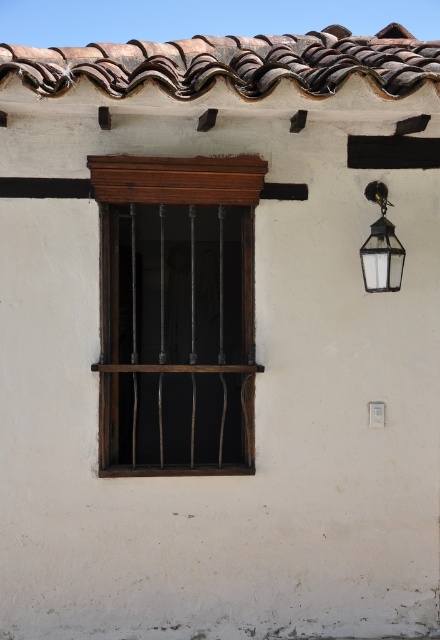
Question: Does brown textured tiles at upper center have a smaller size compared to matte glass lantern at upper right?

Choices:
 (A) yes
 (B) no

Answer: (A)

Question: Considering the real-world distances, which object is closest to the dark wood window frame at center?

Choices:
 (A) matte glass lantern at upper right
 (B) brown textured tiles at upper center

Answer: (A)

Question: Which point is farther to the camera?

Choices:
 (A) (230, 449)
 (B) (381, 220)

Answer: (A)

Question: Which of the following is the farthest from the observer?

Choices:
 (A) brown textured tiles at upper center
 (B) dark wood window frame at center

Answer: (B)

Question: Is dark wood window frame at center thinner than matte glass lantern at upper right?

Choices:
 (A) yes
 (B) no

Answer: (B)

Question: Can you confirm if dark wood window frame at center is smaller than matte glass lantern at upper right?

Choices:
 (A) yes
 (B) no

Answer: (B)